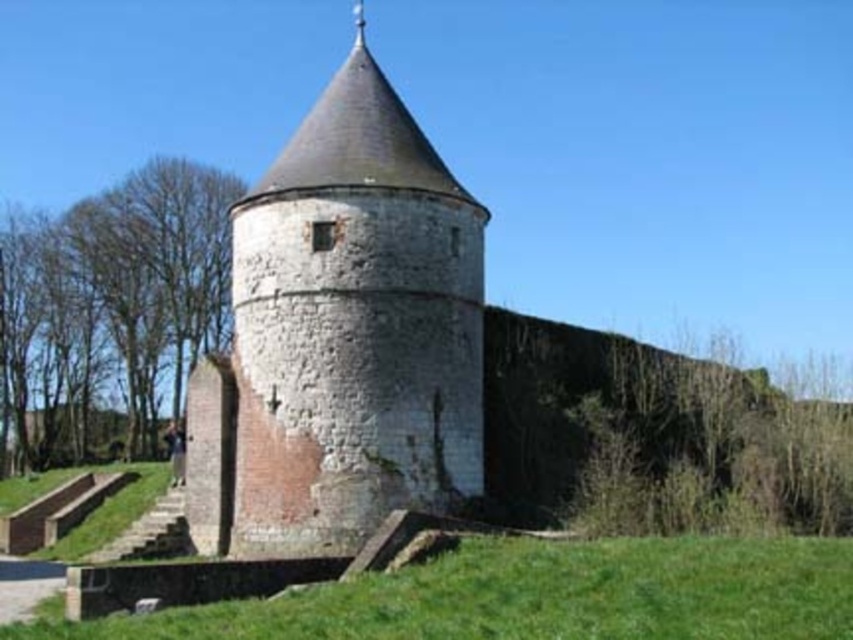
Consider the image. Is white stone tower at center bigger than green grass at lower center?

Yes, white stone tower at center is bigger than green grass at lower center.

Which is in front, point (262, 531) or point (393, 588)?

Point (393, 588) is more forward.

Which is behind, point (341, 192) or point (809, 628)?

Positioned behind is point (341, 192).

The width and height of the screenshot is (853, 640). Find the location of `white stone tower at center`. white stone tower at center is located at coordinates (341, 337).